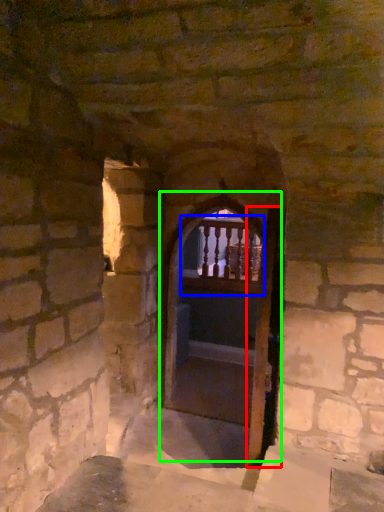
Question: Which object is positioned closest to screen door (highlighted by a red box)? Select from balcony (highlighted by a blue box) and door (highlighted by a green box).

Choices:
 (A) balcony
 (B) door

Answer: (B)